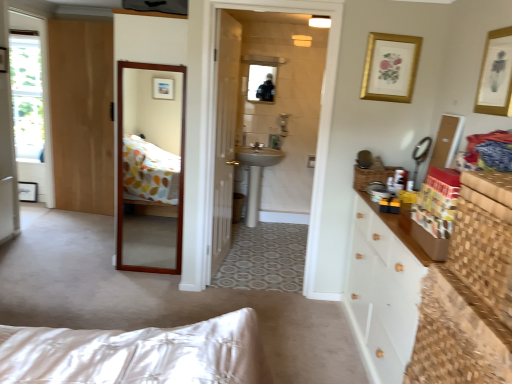
Question: Is woven wood chest at right, the second cabinetry when ordered from back to front, not inside white ceramic sink at center?

Choices:
 (A) yes
 (B) no

Answer: (A)

Question: Is white ceramic sink at center surrounded by woven wood chest at right, the second cabinetry when ordered from back to front?

Choices:
 (A) yes
 (B) no

Answer: (B)

Question: Can you confirm if woven wood chest at right, the 1th cabinetry in the front-to-back sequence, is thinner than white ceramic sink at center?

Choices:
 (A) yes
 (B) no

Answer: (A)

Question: Considering the relative sizes of woven wood chest at right, the 1th cabinetry in the front-to-back sequence, and white ceramic sink at center in the image provided, is woven wood chest at right, the 1th cabinetry in the front-to-back sequence, taller than white ceramic sink at center?

Choices:
 (A) no
 (B) yes

Answer: (A)

Question: From the image's perspective, is woven wood chest at right, the 1th cabinetry in the front-to-back sequence, below white ceramic sink at center?

Choices:
 (A) yes
 (B) no

Answer: (A)

Question: Choose the correct answer: Is wooden drawer at center-right inside light brown wood door at left, the 2th door viewed from the front, or outside it?

Choices:
 (A) inside
 (B) outside

Answer: (B)

Question: From a real-world perspective, is wooden drawer at center-right above or below light brown wood door at left, which is counted as the 2th door, starting from the right?

Choices:
 (A) below
 (B) above

Answer: (A)

Question: Considering the positions of point (355, 183) and point (111, 54), is point (355, 183) closer or farther from the camera than point (111, 54)?

Choices:
 (A) farther
 (B) closer

Answer: (B)

Question: In the image, is wooden drawer at center-right on the left side or the right side of light brown wood door at left, the 2th door viewed from the front?

Choices:
 (A) left
 (B) right

Answer: (B)

Question: Is woven wood chest at right, the second cabinetry when ordered from back to front, situated inside white ceramic sink at center or outside?

Choices:
 (A) outside
 (B) inside

Answer: (A)

Question: Is point (474, 231) positioned closer to the camera than point (271, 150)?

Choices:
 (A) closer
 (B) farther

Answer: (A)

Question: From the image's perspective, relative to white ceramic sink at center, is woven wood chest at right, the 1th cabinetry in the front-to-back sequence, above or below?

Choices:
 (A) above
 (B) below

Answer: (B)

Question: From a real-world perspective, is woven wood chest at right, the 1th cabinetry in the front-to-back sequence, positioned above or below white ceramic sink at center?

Choices:
 (A) below
 (B) above

Answer: (B)

Question: Considering their positions, is satin nickel faucet at center located in front of or behind white satin bed at lower left?

Choices:
 (A) behind
 (B) front

Answer: (A)

Question: From a real-world perspective, is satin nickel faucet at center positioned above or below white satin bed at lower left?

Choices:
 (A) below
 (B) above

Answer: (B)